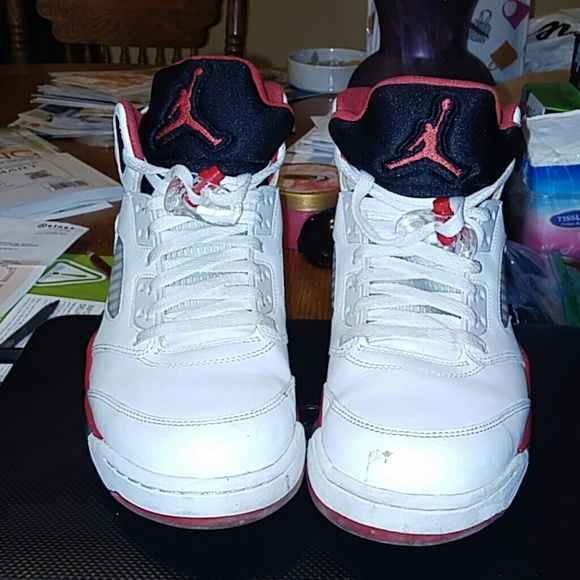
Locate an element on the screen. The image size is (580, 580). package of tissue is located at coordinates (552, 206).